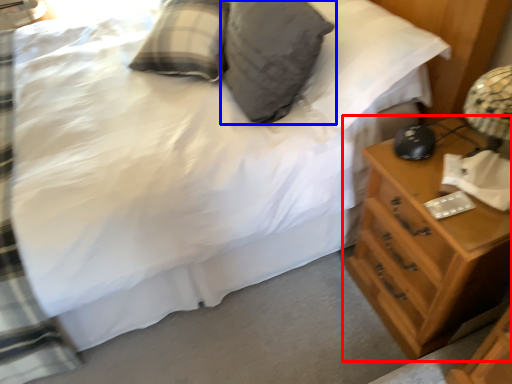
Question: Among these objects, which one is farthest to the camera, chest of drawers (highlighted by a red box) or pillow (highlighted by a blue box)?

Choices:
 (A) chest of drawers
 (B) pillow

Answer: (B)